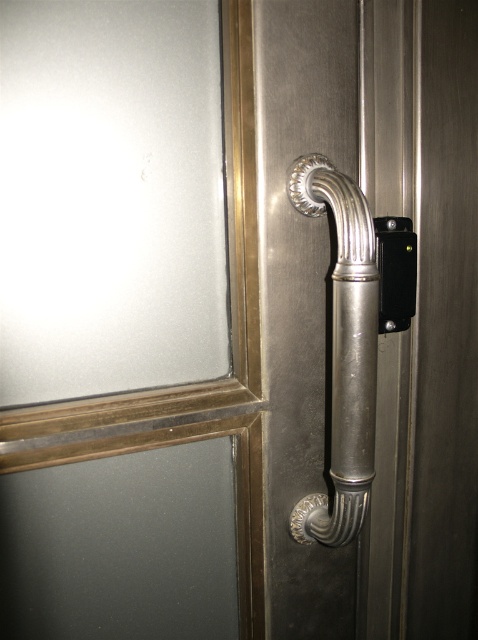
Does frosted glass screen door at upper left have a lesser height compared to black plastic lock at center?

No, frosted glass screen door at upper left is not shorter than black plastic lock at center.

Looking at this image, which of these two, frosted glass screen door at upper left or black plastic lock at center, stands shorter?

black plastic lock at center

Find the location of a particular element. frosted glass screen door at upper left is located at coordinates (229, 273).

From the picture: Can you confirm if frosted glass screen door at upper left is taller than polished silver handle at right?

Correct, frosted glass screen door at upper left is much taller as polished silver handle at right.

Measure the distance between point (148, 433) and camera.

Point (148, 433) is 72.90 centimeters away from camera.

Does point (232, 161) come farther from viewer compared to point (372, 470)?

No, (232, 161) is closer to viewer.

Where is `frosted glass screen door at upper left`? The image size is (478, 640). frosted glass screen door at upper left is located at coordinates (229, 273).

Is polished silver handle at right to the left of black plastic lock at center from the viewer's perspective?

Yes, polished silver handle at right is to the left of black plastic lock at center.

The height and width of the screenshot is (640, 478). I want to click on polished silver handle at right, so click(x=344, y=353).

Does point (347, 419) come farther from viewer compared to point (402, 243)?

That is False.

Locate an element on the screen. polished silver handle at right is located at coordinates (344, 353).